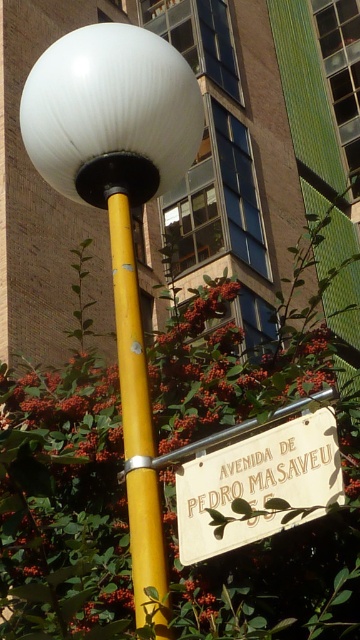
You are a pedestrian standing in front of the yellow pole. You need to look up to see the white glossy sphere at upper left and then look down to see the wooden sign at lower center. Which object requires you to look upward first?

The white glossy sphere at upper left requires you to look upward first because it is positioned above the wooden sign at lower center.

You are a city planner analyzing streetlamp designs. The white glossy sphere at upper left and the yellow matte pole at center are part of a new prototype. Based on the image, which object is shorter in height?

The white glossy sphere at upper left is shorter in height than the yellow matte pole at center.